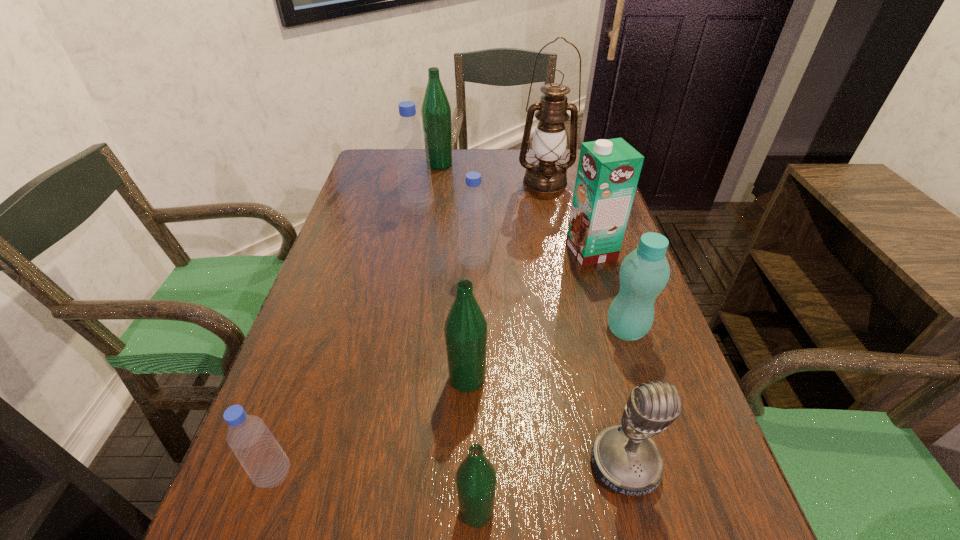
Image resolution: width=960 pixels, height=540 pixels. In order to click on blue bottle that is the nearest to the fourth nearest object in this screenshot , I will do pos(473,204).

Identify the location of the third closest green bottle to the rightmost bottle. The width and height of the screenshot is (960, 540). (436, 111).

The width and height of the screenshot is (960, 540). Identify the location of green bottle that stands as the second closest to the tallest object. (465, 329).

The height and width of the screenshot is (540, 960). Find the location of `vacant point that satisfies the following two spatial constraints: 1. on the front side of the oil lamp; 2. on the left side of the rightmost bottle`. vacant point that satisfies the following two spatial constraints: 1. on the front side of the oil lamp; 2. on the left side of the rightmost bottle is located at coordinates (577, 330).

Find the location of a particular element. The height and width of the screenshot is (540, 960). vacant space that satisfies the following two spatial constraints: 1. on the back side of the carton; 2. on the right side of the nearest blue bottle is located at coordinates (351, 251).

The height and width of the screenshot is (540, 960). In order to click on free space that satisfies the following two spatial constraints: 1. on the back side of the tallest object; 2. on the left side of the rightmost blue bottle in this screenshot , I will do click(x=475, y=182).

Where is `free point that satisfies the following two spatial constraints: 1. on the front side of the fifth farthest bottle; 2. on the left side of the nearest green bottle`? free point that satisfies the following two spatial constraints: 1. on the front side of the fifth farthest bottle; 2. on the left side of the nearest green bottle is located at coordinates (464, 510).